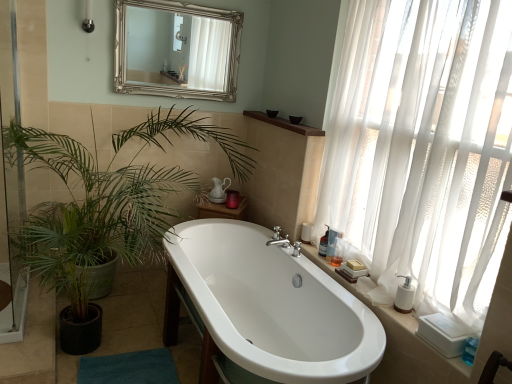
At what (x,y) coordinates should I click in order to perform the action: click on vacant space to the left of white matte soap dispenser at right. Please return your answer as a coordinate pair (x, y). Image resolution: width=512 pixels, height=384 pixels. Looking at the image, I should click on (379, 307).